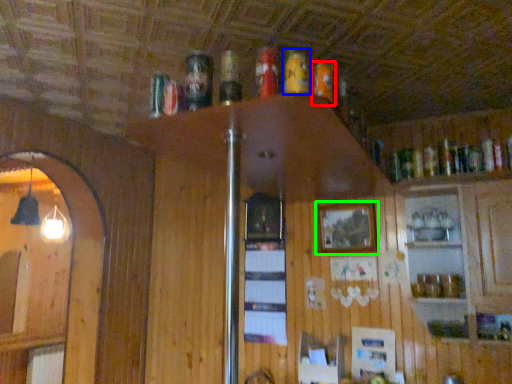
Question: Which object is positioned farthest from beer (highlighted by a red box)? Select from beer (highlighted by a blue box) and picture frame (highlighted by a green box).

Choices:
 (A) beer
 (B) picture frame

Answer: (B)